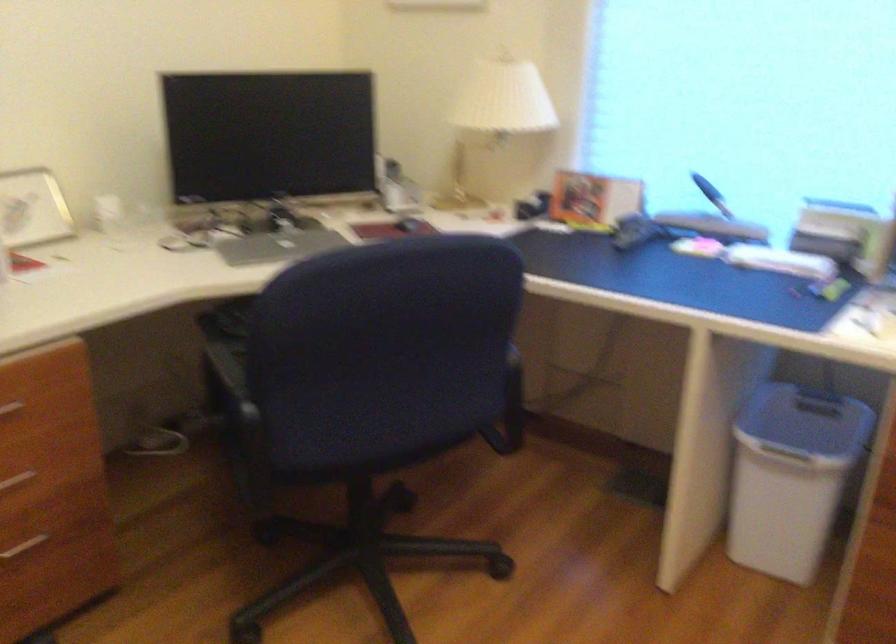
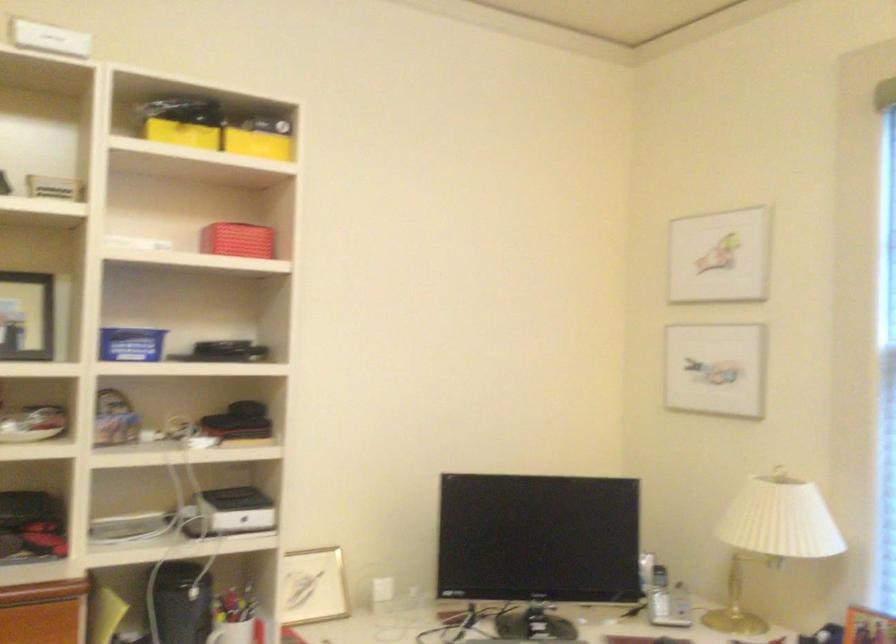
In the second image, find the point that corresponds to (498,111) in the first image.

(771, 538)